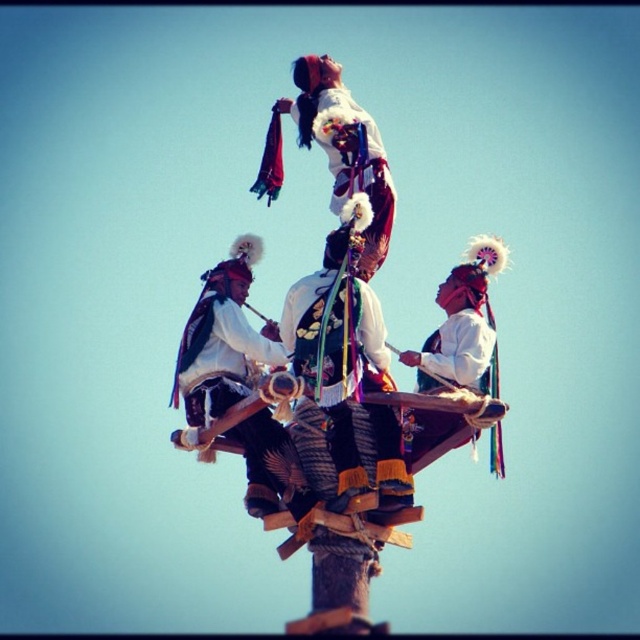
Question: Is white fabric costume at center smaller than white matte headdress at center?

Choices:
 (A) no
 (B) yes

Answer: (B)

Question: Which point appears closest to the camera in this image?

Choices:
 (A) (376, 244)
 (B) (296, 504)

Answer: (B)

Question: Can you confirm if white fabric costume at center is positioned above white matte headdress at center?

Choices:
 (A) no
 (B) yes

Answer: (B)

Question: Which point is closer to the camera?

Choices:
 (A) white fabric costume at center
 (B) white matte fabric at center

Answer: (A)

Question: Considering the relative positions of white matte headdress at center and white matte fabric at center in the image provided, where is white matte headdress at center located with respect to white matte fabric at center?

Choices:
 (A) below
 (B) above

Answer: (A)

Question: Which point is closer to the camera taking this photo?

Choices:
 (A) (336, 464)
 (B) (237, 273)
 (C) (337, 200)

Answer: (A)